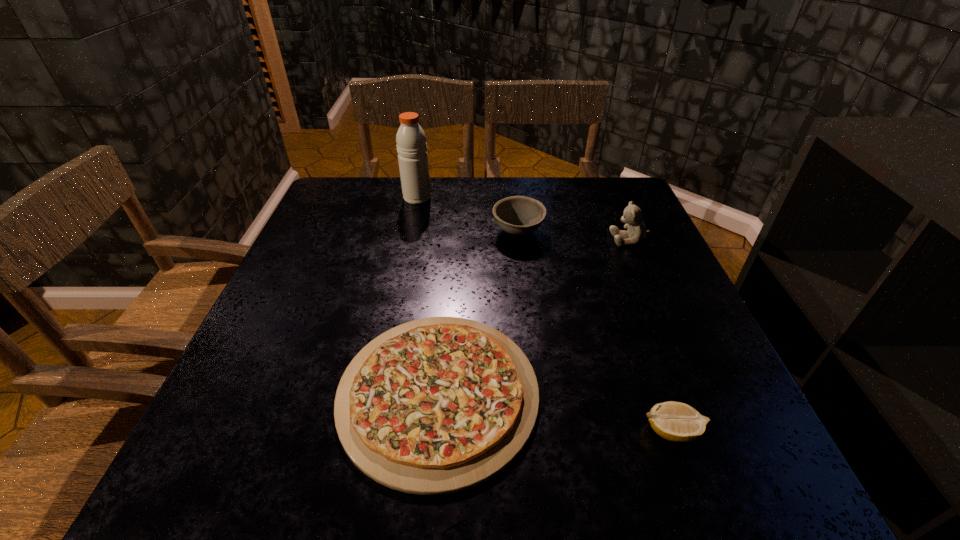
You are a GUI agent. You are given a task and a screenshot of the screen. Output one action in this format:
    pyautogui.click(x=<x>, y=<y>)
    Task: Click on the tallest object
    This screenshot has height=540, width=960.
    Given the screenshot: What is the action you would take?
    pyautogui.click(x=411, y=145)

This screenshot has width=960, height=540. Identify the location of the farthest object. [x=411, y=145].

Identify the location of the fourth shortest object. (632, 216).

Image resolution: width=960 pixels, height=540 pixels. I want to click on the third shortest object, so click(x=517, y=215).

Image resolution: width=960 pixels, height=540 pixels. In order to click on lemon in this screenshot , I will do `click(675, 421)`.

You are a GUI agent. You are given a task and a screenshot of the screen. Output one action in this format:
    pyautogui.click(x=<x>, y=<y>)
    Task: Click on the pizza
    
    Given the screenshot: What is the action you would take?
    pyautogui.click(x=435, y=406)

Where is `vacant space located on the right of the farthest object`? vacant space located on the right of the farthest object is located at coordinates (497, 198).

The height and width of the screenshot is (540, 960). I want to click on blank space located 0.200m on the face of the second tallest object, so click(x=531, y=239).

At what (x,y) coordinates should I click in order to perform the action: click on vacant space located 0.230m on the face of the second tallest object. Please return your answer as a coordinate pair (x, y). The image size is (960, 540). Looking at the image, I should click on (519, 239).

Where is `vacant point located 0.080m on the face of the second tallest object`? Image resolution: width=960 pixels, height=540 pixels. vacant point located 0.080m on the face of the second tallest object is located at coordinates (579, 239).